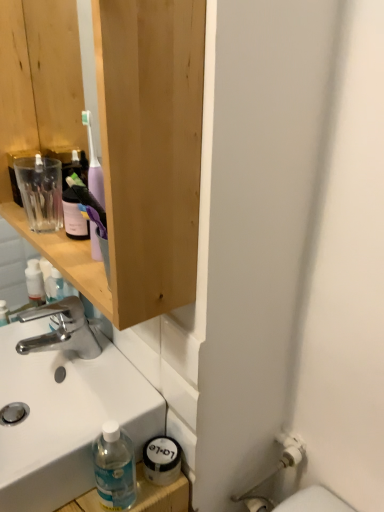
Question: Looking at their shapes, would you say white glossy sink at lower left is wider or thinner than wooden cabinet at upper left?

Choices:
 (A) thin
 (B) wide

Answer: (B)

Question: From the image's perspective, relative to wooden cabinet at upper left, is white glossy sink at lower left above or below?

Choices:
 (A) above
 (B) below

Answer: (B)

Question: Based on their relative distances, which object is nearer to the wooden cabinet at upper left?

Choices:
 (A) polished chrome faucet at center
 (B) white glossy sink at lower left

Answer: (B)

Question: Which of these objects is positioned farthest from the white glossy sink at lower left?

Choices:
 (A) polished chrome faucet at center
 (B) wooden cabinet at upper left

Answer: (B)